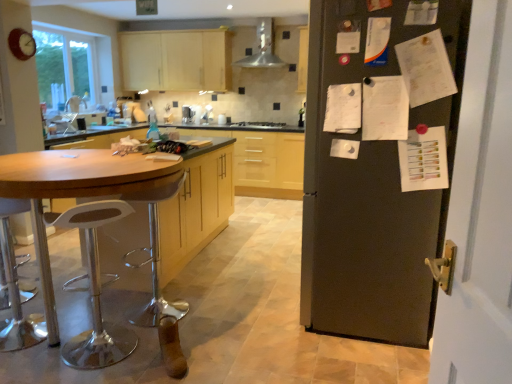
Question: Does wooden table at left have a lesser width compared to satin silver stove at center?

Choices:
 (A) yes
 (B) no

Answer: (B)

Question: Could satin silver stove at center be considered to be inside wooden table at left?

Choices:
 (A) yes
 (B) no

Answer: (B)

Question: From the image's perspective, does wooden table at left appear lower than satin silver stove at center?

Choices:
 (A) yes
 (B) no

Answer: (A)

Question: From a real-world perspective, is wooden table at left under satin silver stove at center?

Choices:
 (A) yes
 (B) no

Answer: (A)

Question: Does wooden table at left have a smaller size compared to satin silver stove at center?

Choices:
 (A) no
 (B) yes

Answer: (A)

Question: From the image's perspective, is white plastic bar stool at left, the first bar stool in the front-to-back sequence, located above or below matte black refrigerator at right?

Choices:
 (A) below
 (B) above

Answer: (A)

Question: Is white plastic bar stool at left, the first bar stool in the front-to-back sequence, situated inside matte black refrigerator at right or outside?

Choices:
 (A) inside
 (B) outside

Answer: (B)

Question: Looking at the image, does white plastic bar stool at left, the first bar stool in the front-to-back sequence, seem bigger or smaller compared to matte black refrigerator at right?

Choices:
 (A) small
 (B) big

Answer: (A)

Question: Is point (110, 360) positioned closer to the camera than point (420, 198)?

Choices:
 (A) closer
 (B) farther

Answer: (B)

Question: In the image, is metallic silver range hood at upper center on the left side or the right side of metallic clock at upper left?

Choices:
 (A) right
 (B) left

Answer: (A)

Question: From a real-world perspective, is metallic silver range hood at upper center physically located above or below metallic clock at upper left?

Choices:
 (A) above
 (B) below

Answer: (A)

Question: Which is correct: metallic silver range hood at upper center is inside metallic clock at upper left, or outside of it?

Choices:
 (A) outside
 (B) inside

Answer: (A)

Question: Relative to metallic clock at upper left, is metallic silver range hood at upper center in front or behind?

Choices:
 (A) behind
 (B) front

Answer: (A)

Question: Visually, is matte black refrigerator at right positioned to the left or to the right of white plastic bar stool at left, the second bar stool in the back-to-front sequence?

Choices:
 (A) left
 (B) right

Answer: (B)

Question: Does point (367, 185) appear closer or farther from the camera than point (124, 203)?

Choices:
 (A) farther
 (B) closer

Answer: (B)